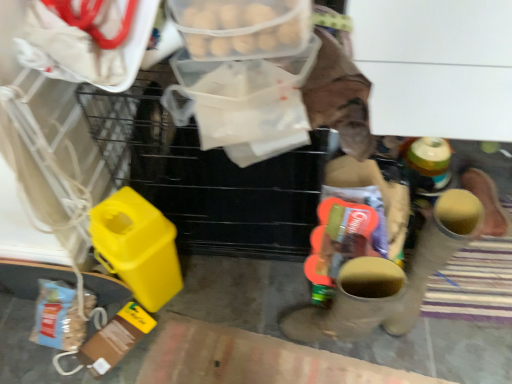
Describe the element at coordinates (242, 27) in the screenshot. I see `translucent plastic container at upper center` at that location.

The height and width of the screenshot is (384, 512). In order to click on rubber yellow boot at right, the second footwear in the left-to-right sequence in this screenshot , I will do `click(435, 251)`.

Locate an element on the screen. translucent plastic container at upper center is located at coordinates (242, 27).

From a real-world perspective, is matte brown boot at center, which appears as the second footwear when viewed from the right, physically below rubber yellow boot at right, which is the 1th footwear in right-to-left order?

Yes, from a real-world perspective, matte brown boot at center, which appears as the second footwear when viewed from the right, is below rubber yellow boot at right, which is the 1th footwear in right-to-left order.

Where is `footwear lying below the rubber yellow boot at right, the second footwear in the left-to-right sequence (from the image's perspective)`? The image size is (512, 384). footwear lying below the rubber yellow boot at right, the second footwear in the left-to-right sequence (from the image's perspective) is located at coordinates (351, 303).

What's the angular difference between matte brown boot at center, which appears as the second footwear when viewed from the right, and rubber yellow boot at right, the second footwear in the left-to-right sequence,'s facing directions?

71.6 degrees separate the facing orientations of matte brown boot at center, which appears as the second footwear when viewed from the right, and rubber yellow boot at right, the second footwear in the left-to-right sequence.

Is matte brown boot at center, positioned as the first footwear in left-to-right order, beside rubber yellow boot at right, the second footwear in the left-to-right sequence?

matte brown boot at center, positioned as the first footwear in left-to-right order, is not next to rubber yellow boot at right, the second footwear in the left-to-right sequence, and they're not touching.

Can you confirm if translucent plastic container at upper center is thinner than matte brown boot at center, positioned as the first footwear in left-to-right order?

Correct, the width of translucent plastic container at upper center is less than that of matte brown boot at center, positioned as the first footwear in left-to-right order.

Between point (279, 0) and point (353, 285), which one is positioned behind?

The point (353, 285) is farther.

Is translucent plastic container at upper center aimed at matte brown boot at center, which appears as the second footwear when viewed from the right?

No, translucent plastic container at upper center is not turned towards matte brown boot at center, which appears as the second footwear when viewed from the right.

How different are the orientations of translucent plastic container at upper center and matte brown boot at center, which appears as the second footwear when viewed from the right, in degrees?

The facing directions of translucent plastic container at upper center and matte brown boot at center, which appears as the second footwear when viewed from the right, are 93.9 degrees apart.

Is rubber yellow boot at right, which is the 1th footwear in right-to-left order, oriented away from matte brown boot at center, which appears as the second footwear when viewed from the right?

That's not correct — rubber yellow boot at right, which is the 1th footwear in right-to-left order, is not looking away from matte brown boot at center, which appears as the second footwear when viewed from the right.

Is rubber yellow boot at right, which is the 1th footwear in right-to-left order, beside matte brown boot at center, positioned as the first footwear in left-to-right order?

rubber yellow boot at right, which is the 1th footwear in right-to-left order, is not next to matte brown boot at center, positioned as the first footwear in left-to-right order, and they're not touching.

Based on the photo, is rubber yellow boot at right, the second footwear in the left-to-right sequence, positioned before matte brown boot at center, which appears as the second footwear when viewed from the right?

No.

Based on the photo, from the image's perspective, which is below, rubber yellow boot at right, the second footwear in the left-to-right sequence, or matte brown boot at center, which appears as the second footwear when viewed from the right?

From the image's view, matte brown boot at center, which appears as the second footwear when viewed from the right, is below.

Is translucent plastic container at upper center oriented away from rubber yellow boot at right, which is the 1th footwear in right-to-left order?

translucent plastic container at upper center does not have its back to rubber yellow boot at right, which is the 1th footwear in right-to-left order.

Is translucent plastic container at upper center beside rubber yellow boot at right, which is the 1th footwear in right-to-left order?

translucent plastic container at upper center and rubber yellow boot at right, which is the 1th footwear in right-to-left order, are not in contact.

Considering the sizes of objects translucent plastic container at upper center and rubber yellow boot at right, the second footwear in the left-to-right sequence, in the image provided, who is taller, translucent plastic container at upper center or rubber yellow boot at right, the second footwear in the left-to-right sequence,?

rubber yellow boot at right, the second footwear in the left-to-right sequence.

From the image's perspective, which is below, matte brown boot at center, positioned as the first footwear in left-to-right order, or translucent plastic container at upper center?

matte brown boot at center, positioned as the first footwear in left-to-right order, appears lower in the image.

Is matte brown boot at center, positioned as the first footwear in left-to-right order, oriented away from translucent plastic container at upper center?

No, matte brown boot at center, positioned as the first footwear in left-to-right order,'s orientation is not away from translucent plastic container at upper center.

Can you confirm if matte brown boot at center, which appears as the second footwear when viewed from the right, is shorter than translucent plastic container at upper center?

In fact, matte brown boot at center, which appears as the second footwear when viewed from the right, may be taller than translucent plastic container at upper center.

From a real-world perspective, is matte brown boot at center, positioned as the first footwear in left-to-right order, physically above translucent plastic container at upper center?

No, from a real-world perspective, matte brown boot at center, positioned as the first footwear in left-to-right order, is not on top of translucent plastic container at upper center.

Based on the photo, is rubber yellow boot at right, which is the 1th footwear in right-to-left order, oriented towards translucent plastic container at upper center?

No.

Based on their positions, is rubber yellow boot at right, which is the 1th footwear in right-to-left order, located to the left or right of translucent plastic container at upper center?

rubber yellow boot at right, which is the 1th footwear in right-to-left order, is to the right of translucent plastic container at upper center.

Can we say rubber yellow boot at right, the second footwear in the left-to-right sequence, lies outside translucent plastic container at upper center?

Yes, rubber yellow boot at right, the second footwear in the left-to-right sequence, is not within translucent plastic container at upper center.

This screenshot has height=384, width=512. Find the location of `footwear above the matte brown boot at center, positioned as the first footwear in left-to-right order (from a real-world perspective)`. footwear above the matte brown boot at center, positioned as the first footwear in left-to-right order (from a real-world perspective) is located at coordinates (435, 251).

The width and height of the screenshot is (512, 384). Find the location of `the 2nd footwear positioned below the translucent plastic container at upper center (from the image's perspective)`. the 2nd footwear positioned below the translucent plastic container at upper center (from the image's perspective) is located at coordinates (351, 303).

When comparing their distances from matte brown boot at center, which appears as the second footwear when viewed from the right, does translucent plastic container at upper center or rubber yellow boot at right, which is the 1th footwear in right-to-left order, seem further?

translucent plastic container at upper center is further to matte brown boot at center, which appears as the second footwear when viewed from the right.

When comparing their distances from rubber yellow boot at right, the second footwear in the left-to-right sequence, does translucent plastic container at upper center or matte brown boot at center, which appears as the second footwear when viewed from the right, seem closer?

matte brown boot at center, which appears as the second footwear when viewed from the right, is positioned closer to the anchor rubber yellow boot at right, the second footwear in the left-to-right sequence.

Estimate the real-world distances between objects in this image. Which object is closer to translucent plastic container at upper center, matte brown boot at center, positioned as the first footwear in left-to-right order, or rubber yellow boot at right, which is the 1th footwear in right-to-left order?

matte brown boot at center, positioned as the first footwear in left-to-right order, is closer to translucent plastic container at upper center.

From the image, which object appears to be farther from rubber yellow boot at right, the second footwear in the left-to-right sequence, matte brown boot at center, positioned as the first footwear in left-to-right order, or translucent plastic container at upper center?

translucent plastic container at upper center is further to rubber yellow boot at right, the second footwear in the left-to-right sequence.

Which object lies further to the anchor point translucent plastic container at upper center, rubber yellow boot at right, which is the 1th footwear in right-to-left order, or matte brown boot at center, positioned as the first footwear in left-to-right order?

rubber yellow boot at right, which is the 1th footwear in right-to-left order, lies further to translucent plastic container at upper center than the other object.

Based on their spatial positions, is rubber yellow boot at right, which is the 1th footwear in right-to-left order, or translucent plastic container at upper center further from matte brown boot at center, positioned as the first footwear in left-to-right order?

translucent plastic container at upper center is further to matte brown boot at center, positioned as the first footwear in left-to-right order.

Find the location of a particular element. The width and height of the screenshot is (512, 384). footwear between translucent plastic container at upper center and matte brown boot at center, positioned as the first footwear in left-to-right order, vertically is located at coordinates (435, 251).